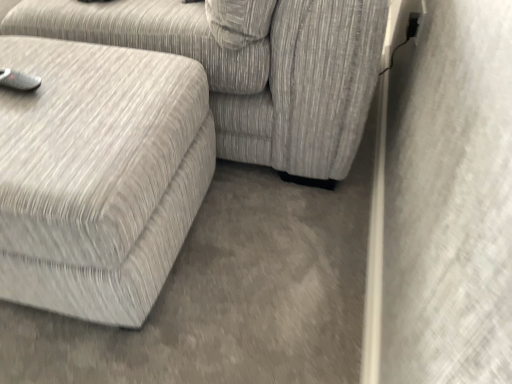
Question: Should I look upward or downward to see textured gray fabric couch at lower left, marked as the 2th studio couch in a bottom-to-top arrangement?

Choices:
 (A) up
 (B) down

Answer: (A)

Question: Does textured gray ottoman at left, which is the 1th studio couch in bottom-to-top order, lie behind textured gray fabric couch at lower left, marked as the 2th studio couch in a bottom-to-top arrangement?

Choices:
 (A) no
 (B) yes

Answer: (A)

Question: From a real-world perspective, is textured gray ottoman at left, which is the 1th studio couch in bottom-to-top order, over textured gray fabric couch at lower left, marked as the 1th studio couch in a top-to-bottom arrangement?

Choices:
 (A) no
 (B) yes

Answer: (A)

Question: Is textured gray ottoman at left, which is the 1th studio couch in bottom-to-top order, facing away from textured gray fabric couch at lower left, marked as the 1th studio couch in a top-to-bottom arrangement?

Choices:
 (A) no
 (B) yes

Answer: (B)

Question: Can you confirm if textured gray ottoman at left, the 2th studio couch in the top-to-bottom sequence, is wider than textured gray fabric couch at lower left, marked as the 1th studio couch in a top-to-bottom arrangement?

Choices:
 (A) yes
 (B) no

Answer: (B)

Question: Does textured gray ottoman at left, the 2th studio couch in the top-to-bottom sequence, have a lesser width compared to textured gray fabric couch at lower left, marked as the 2th studio couch in a bottom-to-top arrangement?

Choices:
 (A) no
 (B) yes

Answer: (B)

Question: Does textured gray ottoman at left, the 2th studio couch in the top-to-bottom sequence, turn towards textured gray fabric couch at lower left, marked as the 1th studio couch in a top-to-bottom arrangement?

Choices:
 (A) no
 (B) yes

Answer: (A)

Question: Is textured gray fabric couch at lower left, marked as the 1th studio couch in a top-to-bottom arrangement, with textured gray ottoman at left, which is the 1th studio couch in bottom-to-top order?

Choices:
 (A) no
 (B) yes

Answer: (A)

Question: Is textured gray fabric couch at lower left, marked as the 2th studio couch in a bottom-to-top arrangement, completely or partially outside of textured gray ottoman at left, the 2th studio couch in the top-to-bottom sequence?

Choices:
 (A) no
 (B) yes

Answer: (B)

Question: Considering the relative positions of textured gray fabric couch at lower left, marked as the 1th studio couch in a top-to-bottom arrangement, and textured gray ottoman at left, which is the 1th studio couch in bottom-to-top order, in the image provided, is textured gray fabric couch at lower left, marked as the 1th studio couch in a top-to-bottom arrangement, behind textured gray ottoman at left, which is the 1th studio couch in bottom-to-top order,?

Choices:
 (A) no
 (B) yes

Answer: (B)

Question: From a real-world perspective, is textured gray fabric couch at lower left, marked as the 1th studio couch in a top-to-bottom arrangement, on top of textured gray ottoman at left, which is the 1th studio couch in bottom-to-top order?

Choices:
 (A) yes
 (B) no

Answer: (A)

Question: Is textured gray fabric couch at lower left, marked as the 2th studio couch in a bottom-to-top arrangement, thinner than textured gray ottoman at left, which is the 1th studio couch in bottom-to-top order?

Choices:
 (A) no
 (B) yes

Answer: (A)

Question: Considering the relative sizes of textured gray fabric couch at lower left, marked as the 2th studio couch in a bottom-to-top arrangement, and textured gray ottoman at left, which is the 1th studio couch in bottom-to-top order, in the image provided, is textured gray fabric couch at lower left, marked as the 2th studio couch in a bottom-to-top arrangement, smaller than textured gray ottoman at left, which is the 1th studio couch in bottom-to-top order,?

Choices:
 (A) no
 (B) yes

Answer: (A)

Question: Relative to textured gray fabric couch at lower left, marked as the 2th studio couch in a bottom-to-top arrangement, is textured gray ottoman at left, which is the 1th studio couch in bottom-to-top order, in front or behind?

Choices:
 (A) front
 (B) behind

Answer: (A)